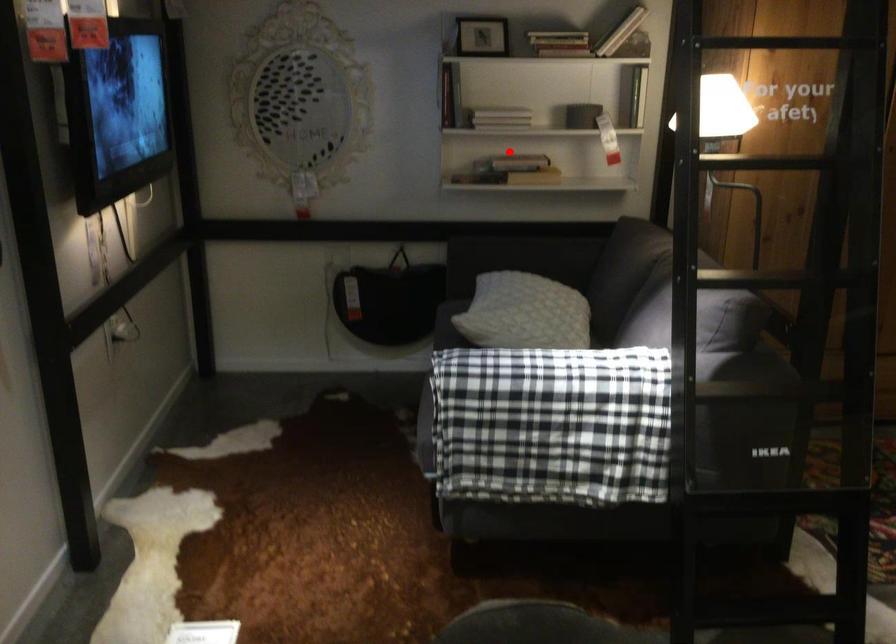
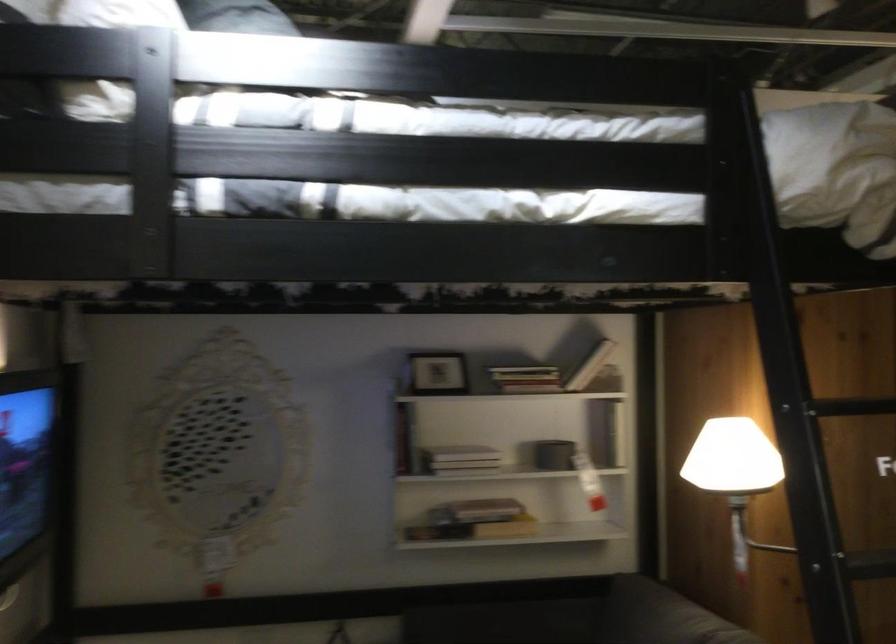
Locate, in the second image, the point that corresponds to the highlighted location in the first image.

(476, 511)